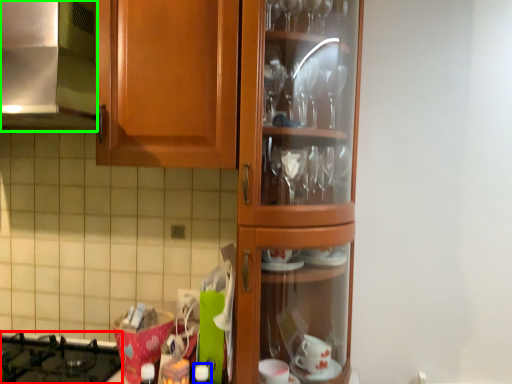
Question: Which object is the farthest from gas stove (highlighted by a red box)? Choose among these: bottle (highlighted by a blue box) or exhaust hood (highlighted by a green box).

Choices:
 (A) bottle
 (B) exhaust hood

Answer: (B)